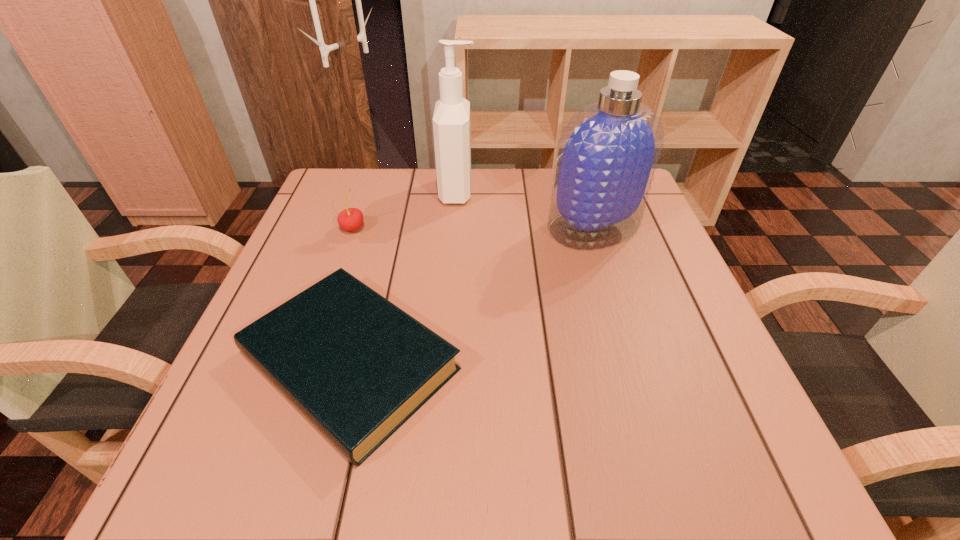
At what (x,y) coordinates should I click in order to perform the action: click on object that is at the near edge. Please return your answer as a coordinate pair (x, y). This screenshot has height=540, width=960. Looking at the image, I should click on (357, 366).

The image size is (960, 540). Identify the location of cherry located at the left edge. (350, 219).

This screenshot has width=960, height=540. I want to click on book present at the left edge, so click(357, 366).

At what (x,y) coordinates should I click in order to perform the action: click on object that is at the right edge. Please return your answer as a coordinate pair (x, y). Looking at the image, I should click on (607, 154).

Find the location of a particular element. This screenshot has height=540, width=960. object that is at the far left corner is located at coordinates (350, 219).

Where is `object that is at the near left corner`? object that is at the near left corner is located at coordinates (357, 366).

Find the location of a particular element. object that is at the far right corner is located at coordinates (607, 154).

The width and height of the screenshot is (960, 540). I want to click on blank space at the far edge of the desktop, so click(410, 180).

The width and height of the screenshot is (960, 540). In the image, there is a desktop. Identify the location of vacant space at the left edge. (324, 231).

The image size is (960, 540). I want to click on vacant space at the right edge of the desktop, so click(716, 377).